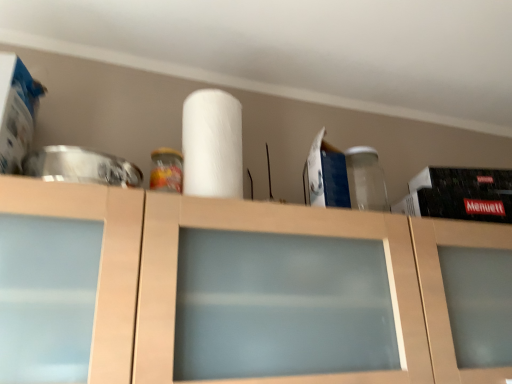
Describe the element at coordinates (212, 145) in the screenshot. Image resolution: width=512 pixels, height=384 pixels. I see `white matte paper towel at center` at that location.

Locate an element on the screen. This screenshot has height=384, width=512. white matte paper towel at center is located at coordinates (212, 145).

The width and height of the screenshot is (512, 384). Describe the element at coordinates (244, 291) in the screenshot. I see `matte wood cabinet at center` at that location.

Measure the distance between matte wood cabinet at center and camera.

matte wood cabinet at center and camera are 25.31 inches apart from each other.

What are the coordinates of `matte wood cabinet at center` in the screenshot? It's located at (244, 291).

The width and height of the screenshot is (512, 384). I want to click on white matte paper towel at center, so click(212, 145).

Which is more to the left, matte wood cabinet at center or white matte paper towel at center?

white matte paper towel at center.

Considering their positions, is matte wood cabinet at center located in front of or behind white matte paper towel at center?

Visually, matte wood cabinet at center is located in front of white matte paper towel at center.

Which point is more forward, (70, 330) or (226, 129)?

Point (70, 330)

From the picture: From the image's perspective, does matte wood cabinet at center appear lower than white matte paper towel at center?

Correct, matte wood cabinet at center appears lower than white matte paper towel at center in the image.

From a real-world perspective, is matte wood cabinet at center above or below white matte paper towel at center?

Clearly, from a real-world perspective, matte wood cabinet at center is below white matte paper towel at center.

Does matte wood cabinet at center have a lesser width compared to white matte paper towel at center?

In fact, matte wood cabinet at center might be wider than white matte paper towel at center.

Considering the sizes of objects matte wood cabinet at center and white matte paper towel at center in the image provided, who is taller, matte wood cabinet at center or white matte paper towel at center?

Standing taller between the two is matte wood cabinet at center.

Does matte wood cabinet at center have a smaller size compared to white matte paper towel at center?

No, matte wood cabinet at center is not smaller than white matte paper towel at center.

Do you think matte wood cabinet at center is within white matte paper towel at center, or outside of it?

matte wood cabinet at center is outside white matte paper towel at center.

Is the surface of matte wood cabinet at center in direct contact with white matte paper towel at center?

No, matte wood cabinet at center is not beside white matte paper towel at center.

Is matte wood cabinet at center aimed at white matte paper towel at center?

No, matte wood cabinet at center is not facing towards white matte paper towel at center.

In the scene shown: How many degrees apart are the facing directions of matte wood cabinet at center and white matte paper towel at center?

The angular difference between matte wood cabinet at center and white matte paper towel at center is 0.00117 degrees.

In order to click on cabinetry in front of the white matte paper towel at center in this screenshot , I will do `click(244, 291)`.

Can you confirm if white matte paper towel at center is positioned to the right of matte wood cabinet at center?

Incorrect, white matte paper towel at center is not on the right side of matte wood cabinet at center.

Between white matte paper towel at center and matte wood cabinet at center, which one is positioned behind?

Positioned behind is white matte paper towel at center.

Is point (185, 127) positioned behind point (97, 361)?

That is True.

From the image's perspective, who appears lower, white matte paper towel at center or matte wood cabinet at center?

matte wood cabinet at center.

From a real-world perspective, does white matte paper towel at center stand above matte wood cabinet at center?

Yes, from a real-world perspective, white matte paper towel at center is above matte wood cabinet at center.

Considering the relative sizes of white matte paper towel at center and matte wood cabinet at center in the image provided, is white matte paper towel at center wider than matte wood cabinet at center?

Incorrect, the width of white matte paper towel at center does not surpass that of matte wood cabinet at center.

From their relative heights in the image, would you say white matte paper towel at center is taller or shorter than matte wood cabinet at center?

In the image, white matte paper towel at center appears to be shorter than matte wood cabinet at center.

Is white matte paper towel at center bigger than matte wood cabinet at center?

Incorrect, white matte paper towel at center is not larger than matte wood cabinet at center.

Is white matte paper towel at center completely or partially outside of matte wood cabinet at center?

Yes, white matte paper towel at center is located beyond the bounds of matte wood cabinet at center.

Is white matte paper towel at center not close to matte wood cabinet at center?

No, white matte paper towel at center is in close proximity to matte wood cabinet at center.

Is white matte paper towel at center oriented towards matte wood cabinet at center?

No.

How different are the orientations of white matte paper towel at center and matte wood cabinet at center in degrees?

0.00117 degrees separate the facing orientations of white matte paper towel at center and matte wood cabinet at center.

Where is `cabinetry lying below the white matte paper towel at center (from the image's perspective)`? This screenshot has width=512, height=384. cabinetry lying below the white matte paper towel at center (from the image's perspective) is located at coordinates (244, 291).

At what (x,y) coordinates should I click in order to perform the action: click on cabinetry located below the white matte paper towel at center (from the image's perspective). Please return your answer as a coordinate pair (x, y). This screenshot has height=384, width=512. Looking at the image, I should click on 244,291.

Find the location of a particular element. The height and width of the screenshot is (384, 512). paper towel on the left of matte wood cabinet at center is located at coordinates (212, 145).